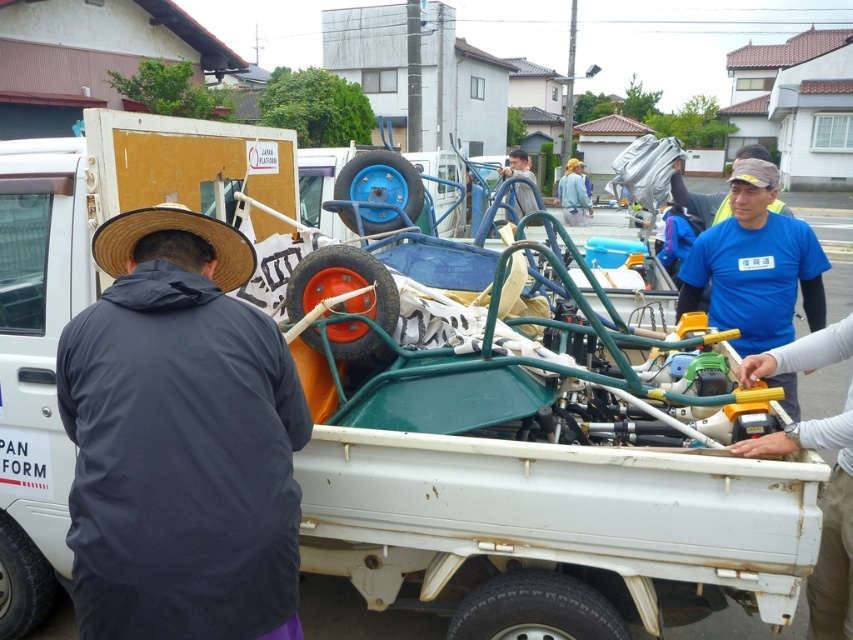
Is point (822, 524) farther from viewer compared to point (527, 176)?

No, it is in front of (527, 176).

Does point (793, 440) come closer to viewer compared to point (523, 170)?

Yes.

What do you see at coordinates (822, 516) in the screenshot? This screenshot has width=853, height=640. I see `white plastic bag at right` at bounding box center [822, 516].

Where is `white plastic bag at right`? white plastic bag at right is located at coordinates (822, 516).

Does green metallic cart at center have a greater width compared to blue fabric jacket at center?

Correct, the width of green metallic cart at center exceeds that of blue fabric jacket at center.

Describe the element at coordinates (531, 449) in the screenshot. I see `green metallic cart at center` at that location.

Does point (519, 388) come in front of point (581, 205)?

Yes, point (519, 388) is in front of point (581, 205).

I want to click on green metallic cart at center, so click(531, 449).

Between green metallic cart at center and light gray fabric shirt at center, which one appears on the right side from the viewer's perspective?

light gray fabric shirt at center is more to the right.

Does green metallic cart at center appear on the right side of light gray fabric shirt at center?

In fact, green metallic cart at center is to the left of light gray fabric shirt at center.

What do you see at coordinates (531, 449) in the screenshot? The width and height of the screenshot is (853, 640). I see `green metallic cart at center` at bounding box center [531, 449].

Identify the location of green metallic cart at center. This screenshot has height=640, width=853. (531, 449).